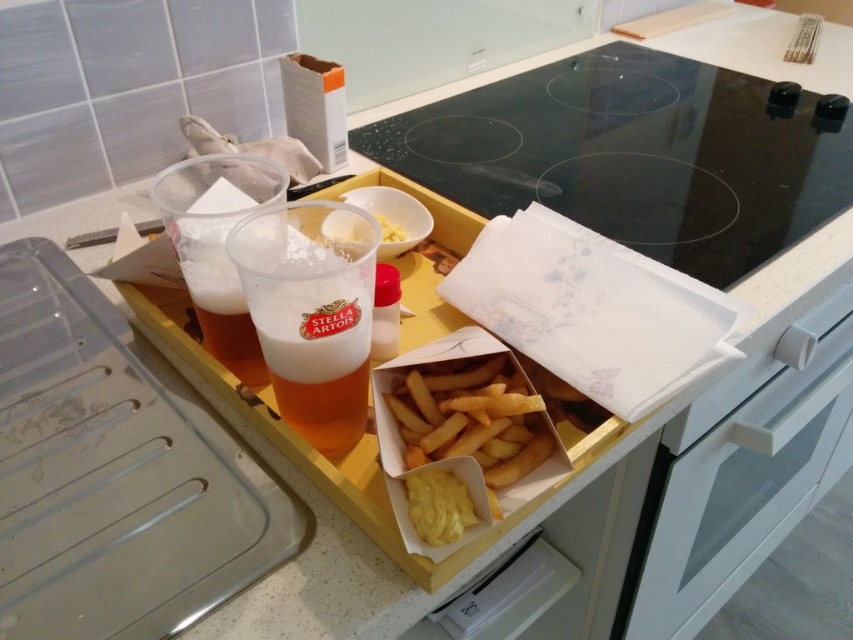
Looking at this image, you are a customer at a diner and want to reach the golden crispy french fries at center. However, there is a white glossy drawer at lower right in the way. Can you move the drawer to access the fries?

The golden crispy french fries at center is behind the white glossy drawer at lower right, so you can move the drawer to access the fries.

Based on the photo, you are a delivery person who just placed a 28 inch long package on the kitchen countertop. You need to slide it towards the white glossy drawer at lower right without moving other items. Is there enough space between the package and the drawer?

The white glossy drawer at lower right is 30.39 inches away from the camera. Since the package is 28 inches long, there is enough space to slide it towards the drawer without moving other items.